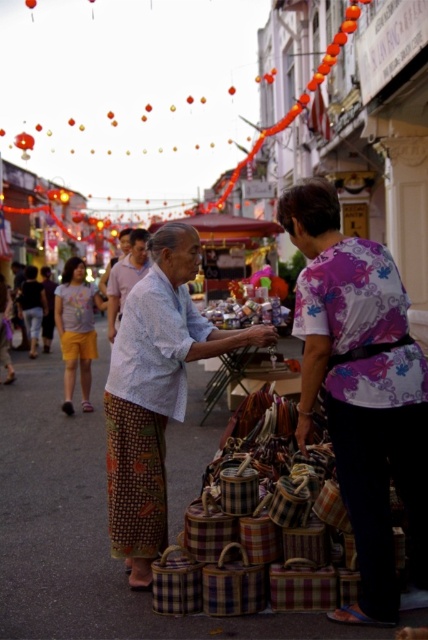
Question: Which object is the closest to the floral-patterned fabric at center?

Choices:
 (A) printed cotton shirt at center
 (B) light blue woven shirt at center
 (C) plaid fabric baskets at center

Answer: (C)

Question: Which point is farther to the camera?

Choices:
 (A) (303, 384)
 (B) (88, 314)

Answer: (B)

Question: Which is nearer to the yellow cotton shorts at left?

Choices:
 (A) plaid fabric baskets at center
 (B) printed cotton shirt at center
 (C) floral-patterned fabric at center
 (D) light blue woven shirt at center

Answer: (D)

Question: Is plaid fabric baskets at center to the left of light blue woven shirt at center from the viewer's perspective?

Choices:
 (A) no
 (B) yes

Answer: (A)

Question: Is floral-patterned fabric at center in front of light blue woven shirt at center?

Choices:
 (A) yes
 (B) no

Answer: (A)

Question: Is printed cotton shirt at center further to camera compared to yellow cotton shorts at left?

Choices:
 (A) no
 (B) yes

Answer: (A)